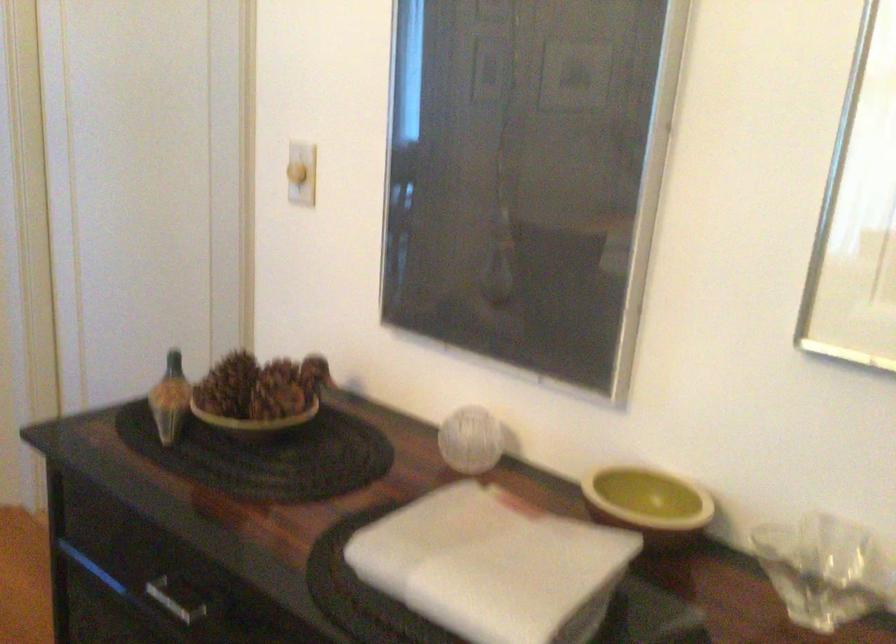
Find where to lift the yellow shallow bowl. Please return your answer as a coordinate pair (x, y).

(648, 503)